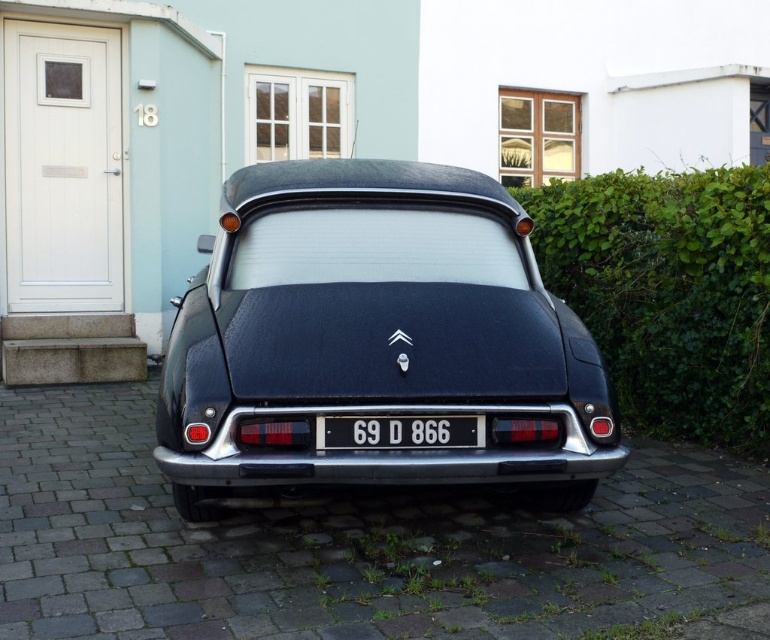
Does point (38, 637) come behind point (343, 186)?

No, (38, 637) is closer to viewer.

Can you confirm if black asphalt driveway at center is positioned to the left of shiny black car at center?

No, black asphalt driveway at center is not to the left of shiny black car at center.

The height and width of the screenshot is (640, 770). Identify the location of black asphalt driveway at center. (357, 547).

Is shiny black car at center below green leafy hedge at right?

Indeed, shiny black car at center is positioned under green leafy hedge at right.

Is shiny black car at center to the right of green leafy hedge at right from the viewer's perspective?

In fact, shiny black car at center is to the left of green leafy hedge at right.

What do you see at coordinates (377, 339) in the screenshot?
I see `shiny black car at center` at bounding box center [377, 339].

The height and width of the screenshot is (640, 770). Identify the location of shiny black car at center. (377, 339).

This screenshot has height=640, width=770. I want to click on black asphalt driveway at center, so click(357, 547).

Is point (136, 410) closer to viewer compared to point (678, 280)?

No, (136, 410) is further to viewer.

Is point (444, 508) farther from viewer compared to point (727, 198)?

No, it is in front of (727, 198).

Locate an element on the screen. black asphalt driveway at center is located at coordinates (357, 547).